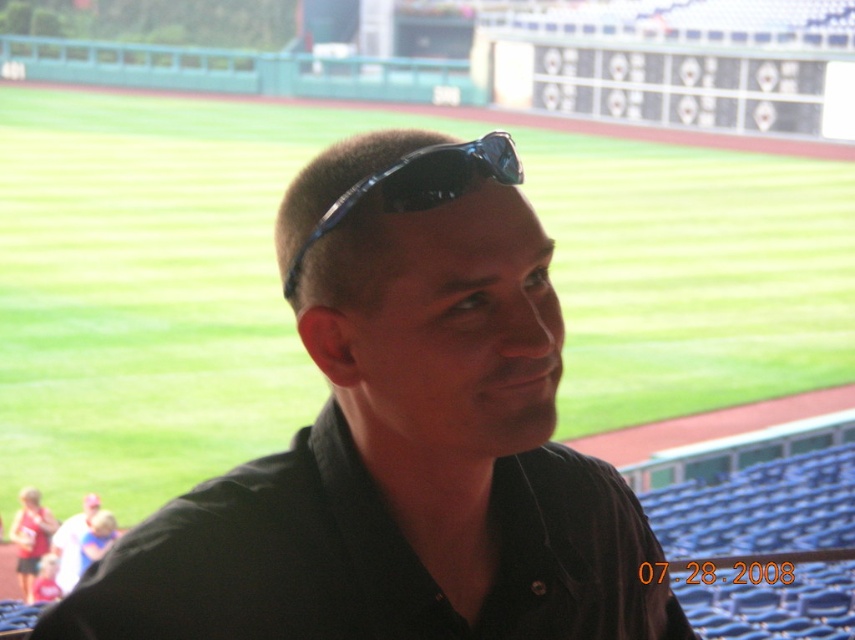
Which is above, black matte shirt at center or black matte sunglasses at center?

black matte sunglasses at center is higher up.

Between point (476, 316) and point (432, 186), which one is positioned behind?

Point (476, 316)

Who is more distant from viewer, (559, 508) or (355, 381)?

The point (559, 508) is more distant.

At what (x,y) coordinates should I click in order to perform the action: click on black matte shirt at center. Please return your answer as a coordinate pair (x, y). Looking at the image, I should click on (401, 440).

Is black matte shirt at center to the right of black plastic sunglasses at center from the viewer's perspective?

Yes, black matte shirt at center is to the right of black plastic sunglasses at center.

Does point (461, 243) lie in front of point (433, 173)?

No, it is behind (433, 173).

Which is behind, point (357, 596) or point (475, 176)?

The point (357, 596) is behind.

At what (x,y) coordinates should I click in order to perform the action: click on black matte shirt at center. Please return your answer as a coordinate pair (x, y). The image size is (855, 640). Looking at the image, I should click on (401, 440).

What do you see at coordinates (425, 292) in the screenshot? I see `black matte sunglasses at center` at bounding box center [425, 292].

Does black matte sunglasses at center have a smaller size compared to black plastic sunglasses at center?

No.

Is point (445, 244) more distant than point (431, 173)?

Yes.

Identify the location of black matte sunglasses at center. (425, 292).